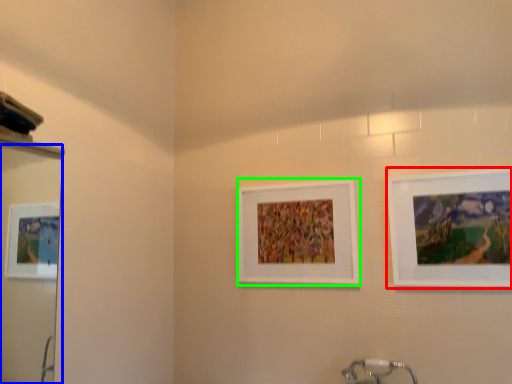
Question: Estimate the real-world distances between objects in this image. Which object is closer to picture frame (highlighted by a red box), mirror (highlighted by a blue box) or picture frame (highlighted by a green box)?

Choices:
 (A) mirror
 (B) picture frame

Answer: (B)